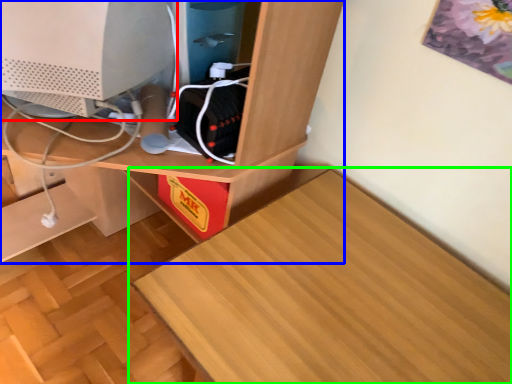
Question: Based on their relative distances, which object is farther from computer monitor (highlighted by a red box)? Choose from desk (highlighted by a blue box) and table (highlighted by a green box).

Choices:
 (A) desk
 (B) table

Answer: (B)